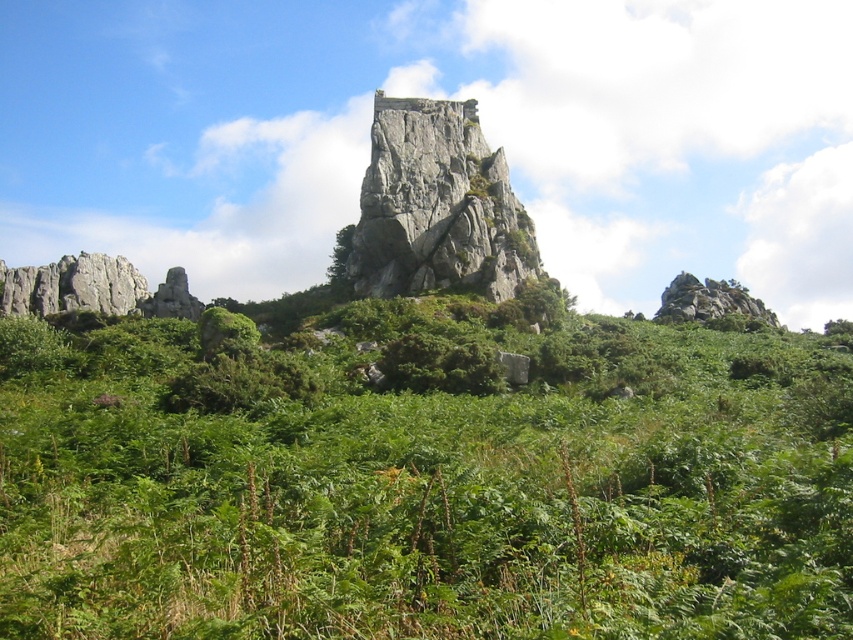
Between green leafy shrubs at center and green leafy tree at center, which one appears on the left side from the viewer's perspective?

Positioned to the left is green leafy tree at center.

Does green leafy shrubs at center lie in front of green leafy tree at center?

Yes, green leafy shrubs at center is in front of green leafy tree at center.

The height and width of the screenshot is (640, 853). What do you see at coordinates (422, 490) in the screenshot?
I see `green leafy shrubs at center` at bounding box center [422, 490].

Image resolution: width=853 pixels, height=640 pixels. Find the location of `green leafy shrubs at center`. green leafy shrubs at center is located at coordinates (422, 490).

Where is `rugged stone rock at center`? rugged stone rock at center is located at coordinates (437, 205).

Who is more forward, (531, 275) or (339, 289)?

Point (339, 289) is in front.

Identify the location of rugged stone rock at center. The image size is (853, 640). (437, 205).

How much distance is there between green leafy shrubs at center and rugged stone rock at center?

The distance of green leafy shrubs at center from rugged stone rock at center is 36.65 meters.

Does green leafy shrubs at center have a lesser width compared to rugged stone rock at center?

Incorrect, green leafy shrubs at center's width is not less than rugged stone rock at center's.

Describe the element at coordinates (422, 490) in the screenshot. I see `green leafy shrubs at center` at that location.

The width and height of the screenshot is (853, 640). Find the location of `green leafy shrubs at center`. green leafy shrubs at center is located at coordinates (422, 490).